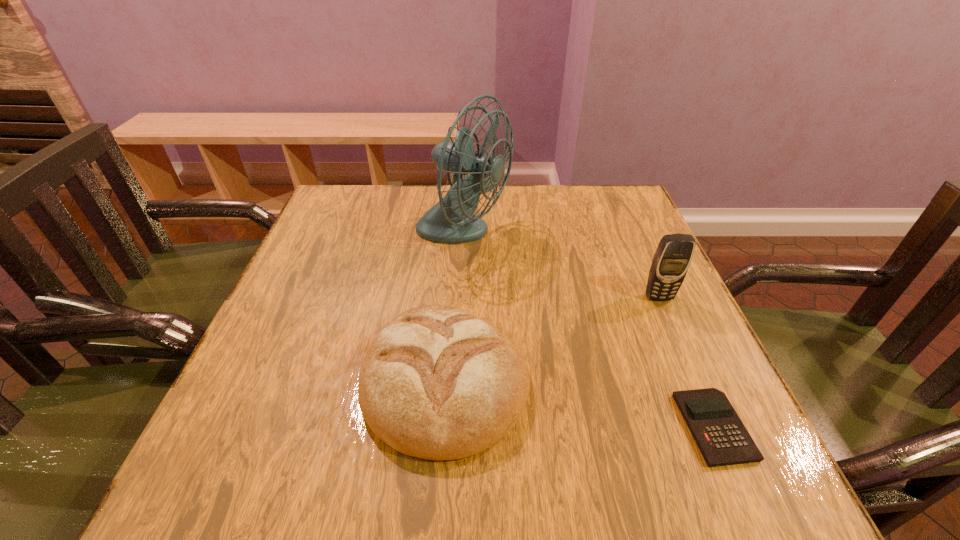
The width and height of the screenshot is (960, 540). In order to click on object that is the third closest one to the third tallest object in this screenshot , I will do `click(673, 256)`.

Where is `free spot that satisfies the following two spatial constraints: 1. on the back side of the calculator; 2. in front of the farthest object to blow air`? Image resolution: width=960 pixels, height=540 pixels. free spot that satisfies the following two spatial constraints: 1. on the back side of the calculator; 2. in front of the farthest object to blow air is located at coordinates (630, 235).

Locate an element on the screen. vacant position in the image that satisfies the following two spatial constraints: 1. in front of the shortest object to blow air; 2. on the right side of the farthest object is located at coordinates (454, 427).

I want to click on blank space that satisfies the following two spatial constraints: 1. in front of the shortest object to blow air; 2. on the right side of the farthest object, so click(454, 427).

Identify the location of free point that satisfies the following two spatial constraints: 1. in front of the tallest object to blow air; 2. on the right side of the calculator. This screenshot has height=540, width=960. (454, 427).